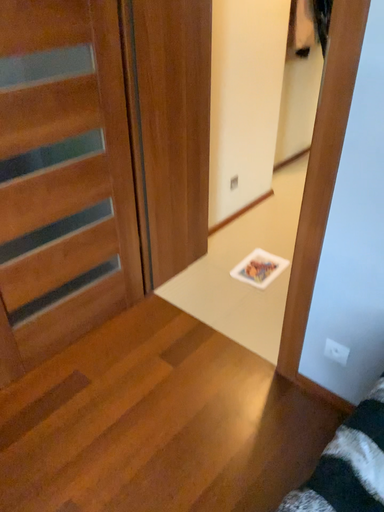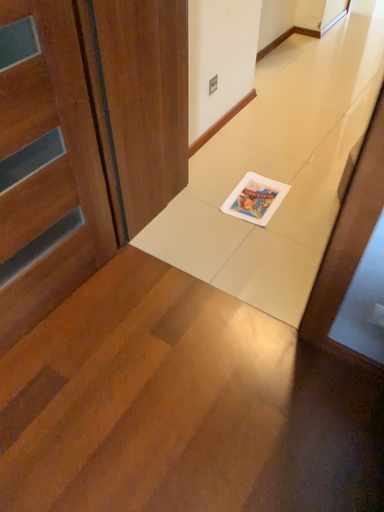
Question: Which way did the camera rotate in the video?

Choices:
 (A) rotated left
 (B) rotated right

Answer: (B)